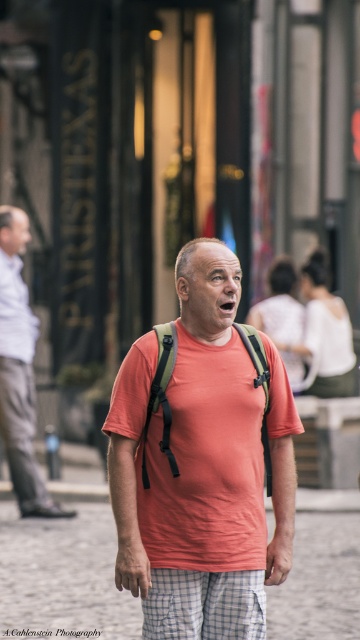
Question: Which of the following is the farthest from the observer?

Choices:
 (A) (24, 516)
 (B) (219, 632)

Answer: (A)

Question: Which point is closer to the camera taking this photo?

Choices:
 (A) (33, 474)
 (B) (144, 384)
 (C) (64, 529)
 (D) (232, 595)

Answer: (D)

Question: Does matte orange t-shirt at center appear on the left side of white checkered shorts at center?

Choices:
 (A) yes
 (B) no

Answer: (A)

Question: Which object is the closest to the white stone pavement at lower center?

Choices:
 (A) matte white shirt at center
 (B) matte orange t-shirt at center

Answer: (A)

Question: Is matte orange t-shirt at center further to camera compared to white stone pavement at lower center?

Choices:
 (A) no
 (B) yes

Answer: (A)

Question: Can you confirm if matte white shirt at center is thinner than white checkered shorts at center?

Choices:
 (A) yes
 (B) no

Answer: (B)